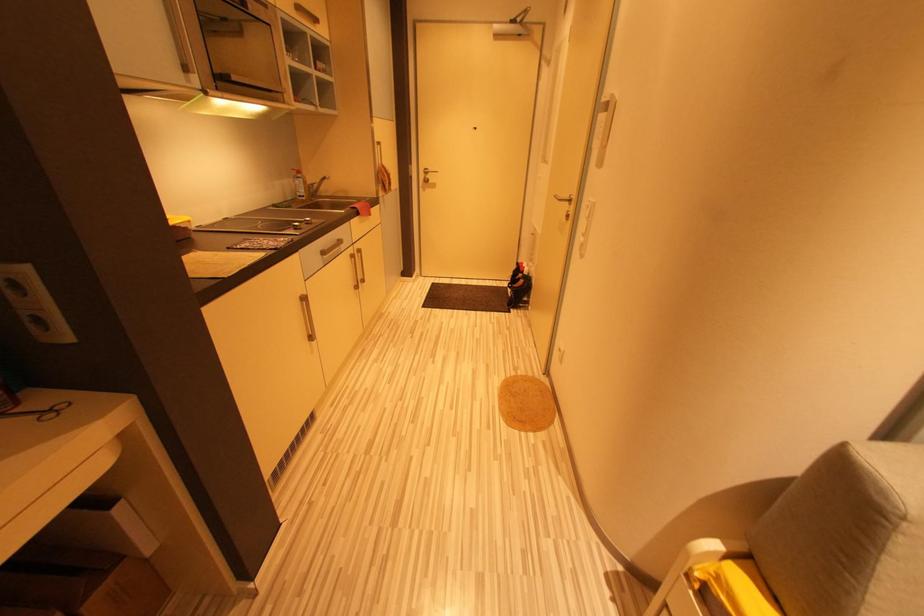
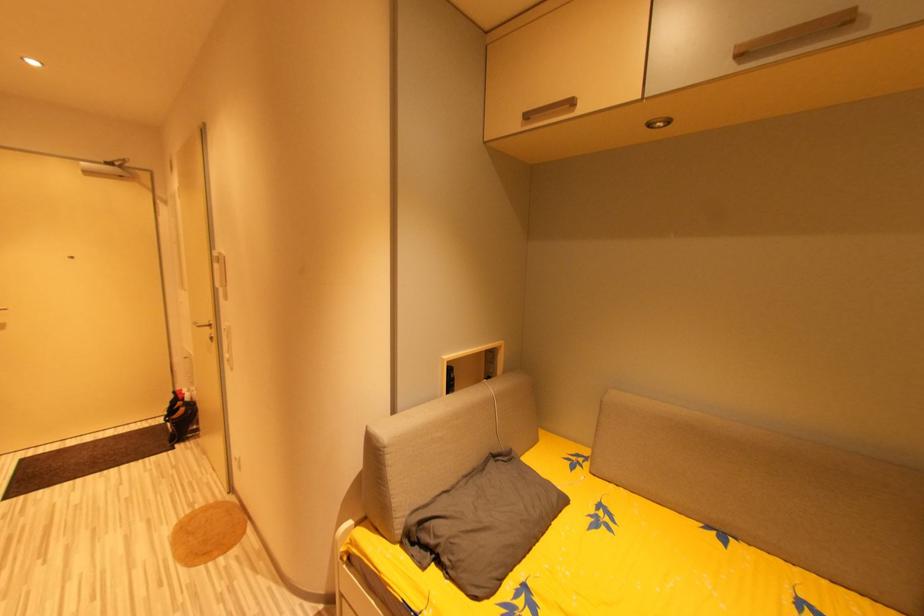
Question: Based on the continuous images, in which direction is the camera rotating? Reply with the corresponding letter.

Choices:
 (A) Left
 (B) Right
 (C) Up
 (D) Down

Answer: (B)